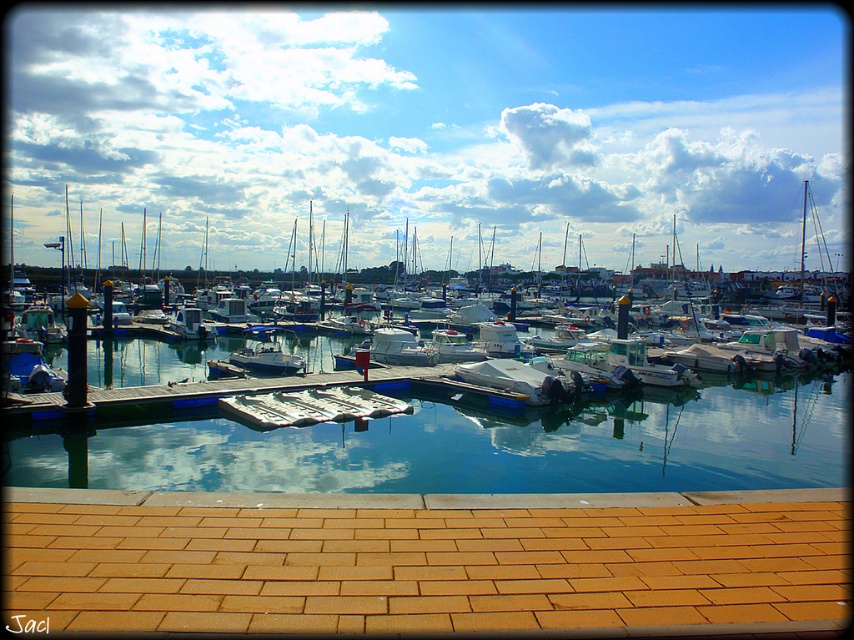
Can you confirm if brick at lower center is wider than white matte boat at center?

No.

Does point (721, 529) come behind point (229, 300)?

No, it is in front of (229, 300).

Image resolution: width=854 pixels, height=640 pixels. Find the location of `brick at lower center`. brick at lower center is located at coordinates (427, 561).

From the picture: Does brick at lower center have a larger size compared to white glossy motorboat at center?

Incorrect, brick at lower center is not larger than white glossy motorboat at center.

Who is higher up, brick at lower center or white glossy motorboat at center?

Positioned higher is white glossy motorboat at center.

Is point (536, 593) positioned behind point (291, 371)?

No.

Where is `brick at lower center`? This screenshot has width=854, height=640. brick at lower center is located at coordinates (427, 561).

Which is behind, point (718, 589) or point (132, 465)?

The point (132, 465) is behind.

Which of these two, brick at lower center or clear glass water at center, stands taller?

clear glass water at center

Between point (48, 602) and point (173, 368), which one is positioned behind?

Point (173, 368)

In order to click on brick at lower center in this screenshot , I will do `click(427, 561)`.